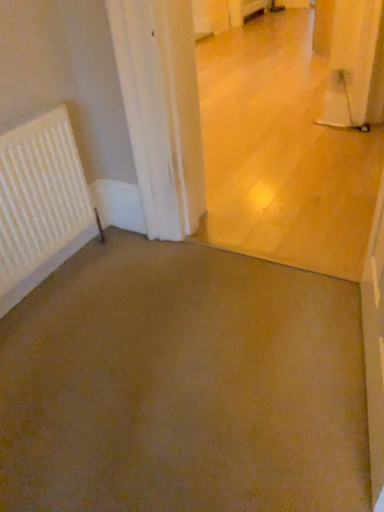
What is the approximate height of brown carpet at lower left, arranged as the second concrete when viewed from the top?

brown carpet at lower left, arranged as the second concrete when viewed from the top, is 3.09 inches tall.

Image resolution: width=384 pixels, height=512 pixels. Describe the element at coordinates (282, 152) in the screenshot. I see `brown matte concrete at center, the 1th concrete viewed from the top` at that location.

Identify the location of brown carpet at lower left, the first concrete when ordered from bottom to top. This screenshot has width=384, height=512. (183, 386).

Is white matte radiator at left wider than brown matte concrete at center, marked as the second concrete in a bottom-to-top arrangement?

No, white matte radiator at left is not wider than brown matte concrete at center, marked as the second concrete in a bottom-to-top arrangement.

From a real-world perspective, who is located higher, white matte radiator at left or brown matte concrete at center, the 1th concrete viewed from the top?

In real-world perspective, brown matte concrete at center, the 1th concrete viewed from the top, is above.

Where is `radiator behind the brown matte concrete at center, marked as the second concrete in a bottom-to-top arrangement`? The width and height of the screenshot is (384, 512). radiator behind the brown matte concrete at center, marked as the second concrete in a bottom-to-top arrangement is located at coordinates (40, 203).

How far apart are white matte radiator at left and brown matte concrete at center, marked as the second concrete in a bottom-to-top arrangement?

3.28 feet.

Could you tell me if white matte radiator at left is facing brown carpet at lower left, the first concrete when ordered from bottom to top?

Yes, white matte radiator at left is aimed at brown carpet at lower left, the first concrete when ordered from bottom to top.

Could you measure the distance between white matte radiator at left and brown carpet at lower left, arranged as the second concrete when viewed from the top?

22.38 inches.

Is white matte radiator at left next to brown carpet at lower left, arranged as the second concrete when viewed from the top, and touching it?

No, white matte radiator at left is not in contact with brown carpet at lower left, arranged as the second concrete when viewed from the top.

Considering the positions of objects white matte radiator at left and brown carpet at lower left, arranged as the second concrete when viewed from the top, in the image provided, who is more to the left, white matte radiator at left or brown carpet at lower left, arranged as the second concrete when viewed from the top,?

From the viewer's perspective, white matte radiator at left appears more on the left side.

In the scene shown: In the image, is brown matte concrete at center, the 1th concrete viewed from the top, positioned in front of or behind white matte radiator at left?

brown matte concrete at center, the 1th concrete viewed from the top, is in front of white matte radiator at left.

Which is further, (286, 135) or (27, 180)?

The point (286, 135) is farther.

Does brown matte concrete at center, marked as the second concrete in a bottom-to-top arrangement, have a lesser width compared to white matte radiator at left?

In fact, brown matte concrete at center, marked as the second concrete in a bottom-to-top arrangement, might be wider than white matte radiator at left.

You are a GUI agent. You are given a task and a screenshot of the screen. Output one action in this format:
    pyautogui.click(x=<x>, y=<y>)
    Task: Click on the concrete above the white matte radiator at left (from the image's perspective)
    
    Given the screenshot: What is the action you would take?
    pyautogui.click(x=282, y=152)

Which is nearer, (299, 276) or (259, 226)?

The point (299, 276) is in front.

Which of these two, brown carpet at lower left, the first concrete when ordered from bottom to top, or brown matte concrete at center, the 1th concrete viewed from the top, is smaller?

brown carpet at lower left, the first concrete when ordered from bottom to top, is smaller.

Is brown carpet at lower left, the first concrete when ordered from bottom to top, oriented away from brown matte concrete at center, the 1th concrete viewed from the top?

No, brown carpet at lower left, the first concrete when ordered from bottom to top,'s orientation is not away from brown matte concrete at center, the 1th concrete viewed from the top.

Based on the photo, is brown carpet at lower left, the first concrete when ordered from bottom to top, wider than white matte radiator at left?

Yes.

Does brown carpet at lower left, arranged as the second concrete when viewed from the top, come in front of white matte radiator at left?

Yes, it is in front of white matte radiator at left.

Which is more to the right, brown carpet at lower left, the first concrete when ordered from bottom to top, or white matte radiator at left?

brown carpet at lower left, the first concrete when ordered from bottom to top.

Looking at the image, does brown carpet at lower left, the first concrete when ordered from bottom to top, seem bigger or smaller compared to white matte radiator at left?

brown carpet at lower left, the first concrete when ordered from bottom to top, is bigger than white matte radiator at left.

Considering the relative positions of brown matte concrete at center, the 1th concrete viewed from the top, and brown carpet at lower left, arranged as the second concrete when viewed from the top, in the image provided, is brown matte concrete at center, the 1th concrete viewed from the top, to the left or to the right of brown carpet at lower left, arranged as the second concrete when viewed from the top,?

Based on their positions, brown matte concrete at center, the 1th concrete viewed from the top, is located to the right of brown carpet at lower left, arranged as the second concrete when viewed from the top.

Where is `concrete directly beneath the brown matte concrete at center, marked as the second concrete in a bottom-to-top arrangement (from a real-world perspective)`? concrete directly beneath the brown matte concrete at center, marked as the second concrete in a bottom-to-top arrangement (from a real-world perspective) is located at coordinates (183, 386).

Choose the correct answer: Is brown matte concrete at center, marked as the second concrete in a bottom-to-top arrangement, inside brown carpet at lower left, the first concrete when ordered from bottom to top, or outside it?

brown matte concrete at center, marked as the second concrete in a bottom-to-top arrangement, cannot be found inside brown carpet at lower left, the first concrete when ordered from bottom to top.

From a real-world perspective, is brown matte concrete at center, marked as the second concrete in a bottom-to-top arrangement, physically located above or below brown carpet at lower left, arranged as the second concrete when viewed from the top?

brown matte concrete at center, marked as the second concrete in a bottom-to-top arrangement, is above brown carpet at lower left, arranged as the second concrete when viewed from the top.

Which concrete is the 2nd one when counting from the right side of the white matte radiator at left? Please provide its 2D coordinates.

[(282, 152)]

Where is `radiator behind the brown carpet at lower left, arranged as the second concrete when viewed from the top`? The width and height of the screenshot is (384, 512). radiator behind the brown carpet at lower left, arranged as the second concrete when viewed from the top is located at coordinates (40, 203).

Looking at the image, which one is located further to brown carpet at lower left, the first concrete when ordered from bottom to top, white matte radiator at left or brown matte concrete at center, the 1th concrete viewed from the top?

Among the two, brown matte concrete at center, the 1th concrete viewed from the top, is located further to brown carpet at lower left, the first concrete when ordered from bottom to top.

From the image, which object appears to be farther from white matte radiator at left, brown carpet at lower left, the first concrete when ordered from bottom to top, or brown matte concrete at center, the 1th concrete viewed from the top?

Among the two, brown matte concrete at center, the 1th concrete viewed from the top, is located further to white matte radiator at left.

Looking at the image, which one is located further to brown matte concrete at center, the 1th concrete viewed from the top, brown carpet at lower left, arranged as the second concrete when viewed from the top, or white matte radiator at left?

Among the two, white matte radiator at left is located further to brown matte concrete at center, the 1th concrete viewed from the top.

Considering their positions, is brown matte concrete at center, marked as the second concrete in a bottom-to-top arrangement, positioned further to brown carpet at lower left, arranged as the second concrete when viewed from the top, than white matte radiator at left?

Among the two, brown matte concrete at center, marked as the second concrete in a bottom-to-top arrangement, is located further to brown carpet at lower left, arranged as the second concrete when viewed from the top.

Based on their spatial positions, is white matte radiator at left or brown carpet at lower left, arranged as the second concrete when viewed from the top, closer to brown matte concrete at center, marked as the second concrete in a bottom-to-top arrangement?

Based on the image, brown carpet at lower left, arranged as the second concrete when viewed from the top, appears to be nearer to brown matte concrete at center, marked as the second concrete in a bottom-to-top arrangement.

Considering their positions, is brown matte concrete at center, the 1th concrete viewed from the top, positioned closer to white matte radiator at left than brown carpet at lower left, arranged as the second concrete when viewed from the top?

brown carpet at lower left, arranged as the second concrete when viewed from the top, is positioned closer to the anchor white matte radiator at left.

At what (x,y) coordinates should I click in order to perform the action: click on concrete situated between white matte radiator at left and brown matte concrete at center, the 1th concrete viewed from the top, from left to right. Please return your answer as a coordinate pair (x, y). The width and height of the screenshot is (384, 512). Looking at the image, I should click on (183, 386).